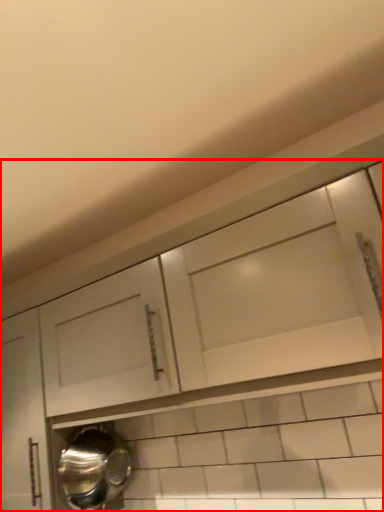
Question: Observing the image, what is the correct spatial positioning of cabinetry (annotated by the red box) in reference to water heater?

Choices:
 (A) right
 (B) left

Answer: (A)